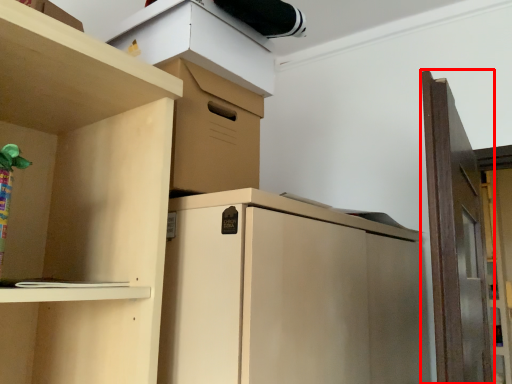
Question: From the image's perspective, where is door (annotated by the red box) located in relation to cabinet in the image?

Choices:
 (A) above
 (B) below

Answer: (B)